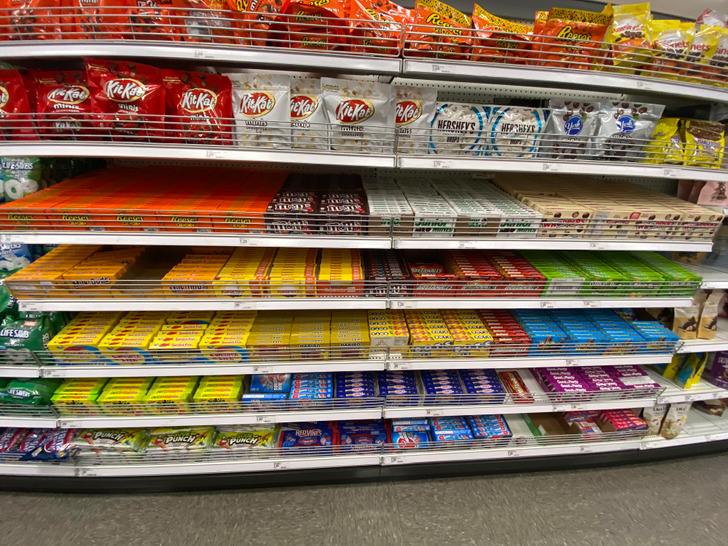
Where is `slight beige ceiling`? The image size is (728, 546). slight beige ceiling is located at coordinates (686, 5).